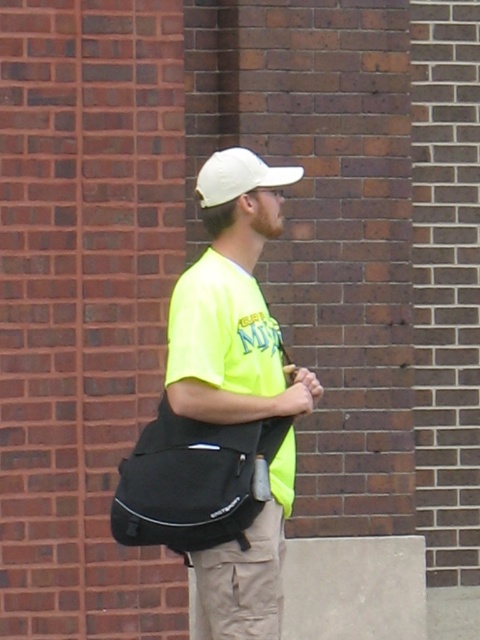
Question: Which object is closer to the camera taking this photo?

Choices:
 (A) neon yellow t-shirt at center
 (B) khaki cotton pants at lower center
 (C) white matte baseball cap at center

Answer: (A)

Question: Does neon yellow t-shirt at center have a larger size compared to black fabric messenger bag at center?

Choices:
 (A) no
 (B) yes

Answer: (B)

Question: Is neon yellow t-shirt at center to the right of black fabric messenger bag at center from the viewer's perspective?

Choices:
 (A) yes
 (B) no

Answer: (A)

Question: Is black fabric messenger bag at center to the left of khaki cotton pants at lower center from the viewer's perspective?

Choices:
 (A) no
 (B) yes

Answer: (B)

Question: Which object appears closest to the camera in this image?

Choices:
 (A) black fabric messenger bag at center
 (B) neon yellow t-shirt at center

Answer: (A)

Question: Which point appears farthest from the camera in this image?

Choices:
 (A) (203, 195)
 (B) (264, 204)

Answer: (A)